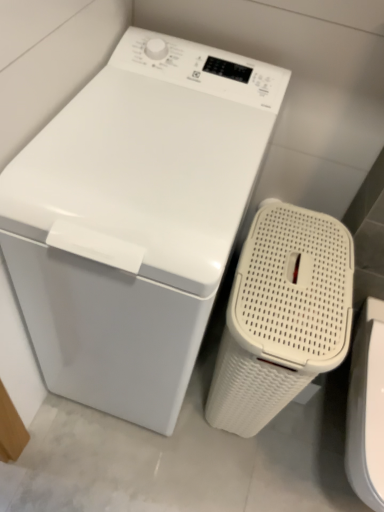
Question: From their relative heights in the image, would you say white glossy washing machine at center is taller or shorter than white woven laundry basket at right?

Choices:
 (A) short
 (B) tall

Answer: (B)

Question: Considering the positions of white glossy washing machine at center and white woven laundry basket at right in the image, is white glossy washing machine at center bigger or smaller than white woven laundry basket at right?

Choices:
 (A) small
 (B) big

Answer: (B)

Question: From the image's perspective, is white glossy washing machine at center located above or below white woven laundry basket at right?

Choices:
 (A) below
 (B) above

Answer: (B)

Question: In terms of height, does white woven laundry basket at right look taller or shorter compared to white glossy washing machine at center?

Choices:
 (A) tall
 (B) short

Answer: (B)

Question: In terms of width, does white woven laundry basket at right look wider or thinner when compared to white glossy washing machine at center?

Choices:
 (A) thin
 (B) wide

Answer: (A)

Question: Based on their positions, is white woven laundry basket at right located to the left or right of white glossy washing machine at center?

Choices:
 (A) left
 (B) right

Answer: (B)

Question: From a real-world perspective, is white woven laundry basket at right physically located above or below white glossy washing machine at center?

Choices:
 (A) below
 (B) above

Answer: (A)